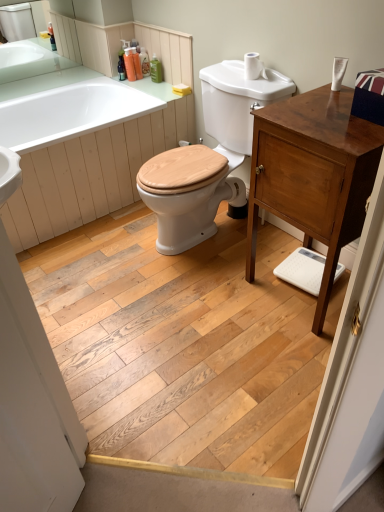
Identify the location of free area in between shiny brown cabinet at right and natural wood screen door at lower left. (185, 310).